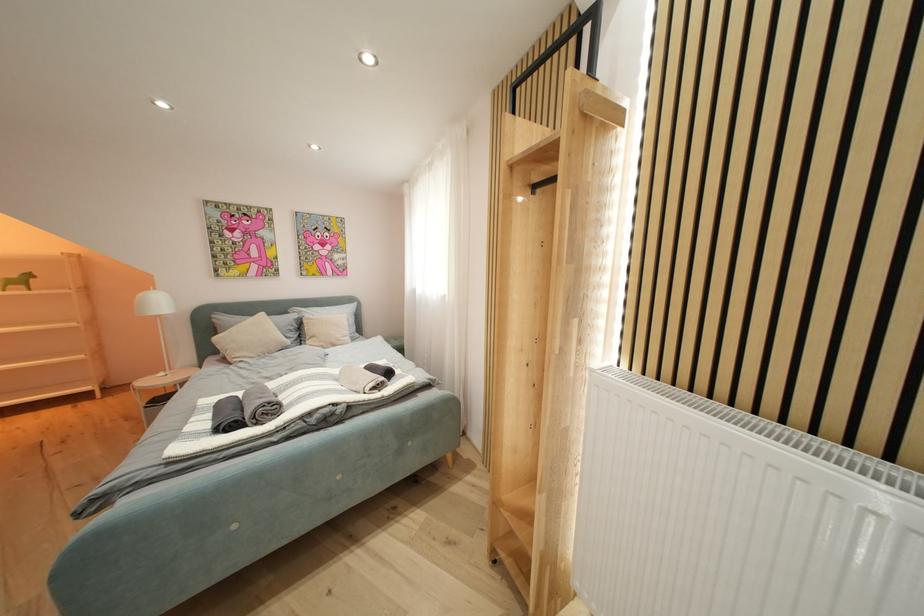
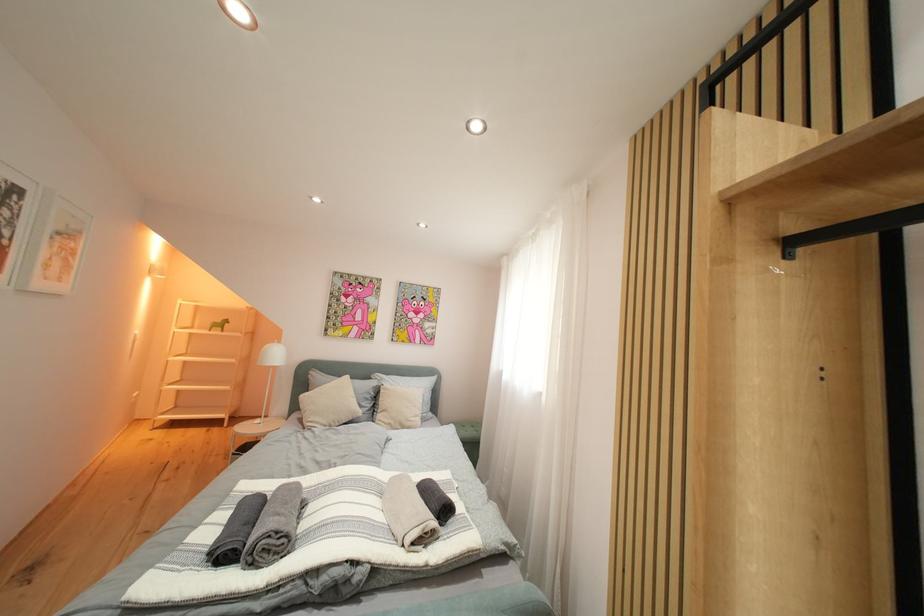
Question: The camera is either moving clockwise (left) or counter-clockwise (right) around the object. The first image is from the beginning of the video and the second image is from the end. Is the camera moving left or right when shooting the video?

Choices:
 (A) Left
 (B) Right

Answer: (B)